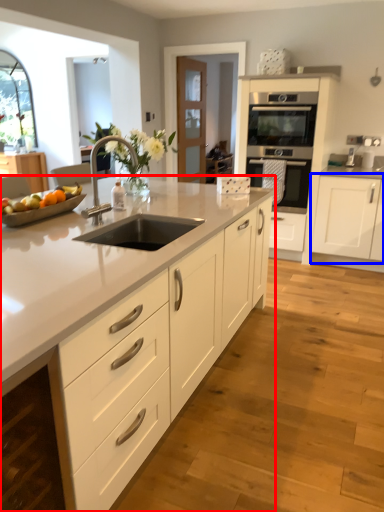
Question: Which object appears closest to the camera in this image, countertop (highlighted by a red box) or cabinetry (highlighted by a blue box)?

Choices:
 (A) countertop
 (B) cabinetry

Answer: (A)